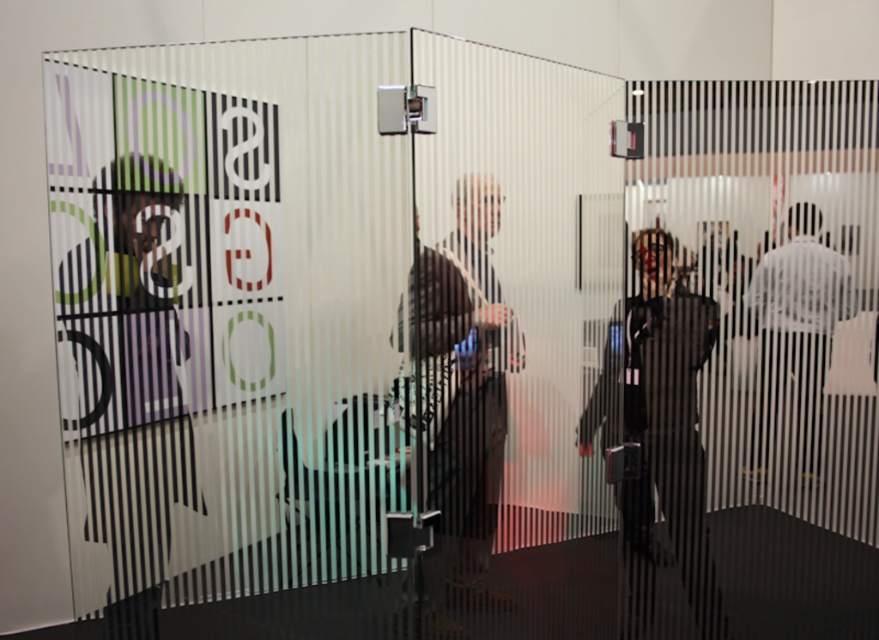
Who is more distant from viewer, (117, 384) or (447, 376)?

The point (117, 384) is behind.

Between matte black shirt at left and matte black laptop at center, which one has less height?

matte black laptop at center

Does point (86, 408) lie behind point (453, 326)?

That is True.

Identify the location of matte black shirt at left. The width and height of the screenshot is (879, 640). (133, 376).

Describe the element at coordinates (461, 385) in the screenshot. I see `matte black laptop at center` at that location.

Which is in front, point (416, 339) or point (648, 280)?

Positioned in front is point (416, 339).

Identify the location of matte black laptop at center. (461, 385).

Which is behind, point (498, 227) or point (794, 333)?

Point (794, 333)

Is matte black laptop at center behind white matte shirt at right?

No.

Is point (445, 464) less distant than point (774, 380)?

That is True.

You are a GUI agent. You are given a task and a screenshot of the screen. Output one action in this format:
    pyautogui.click(x=<x>, y=<y>)
    Task: Click on the matte black laptop at center
    The height and width of the screenshot is (640, 879).
    Given the screenshot: What is the action you would take?
    pyautogui.click(x=461, y=385)